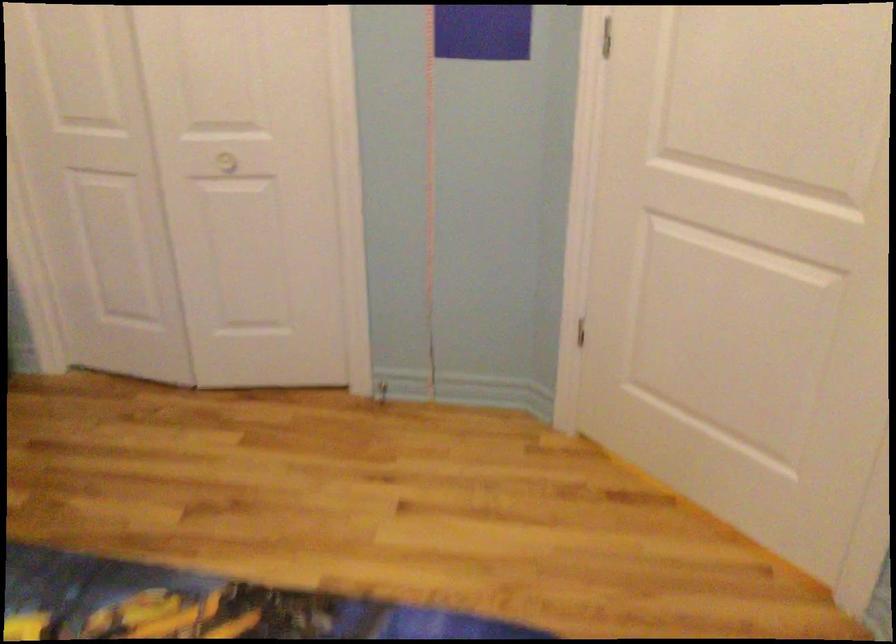
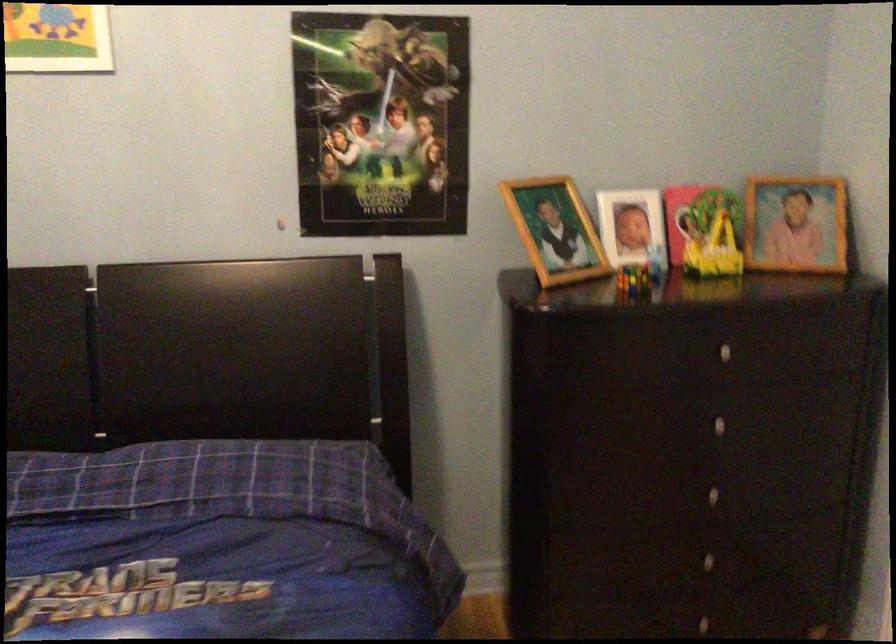
Question: The camera is either moving clockwise (left) or counter-clockwise (right) around the object. The first image is from the beginning of the video and the second image is from the end. Is the camera moving left or right when shooting the video?

Choices:
 (A) Left
 (B) Right

Answer: (B)